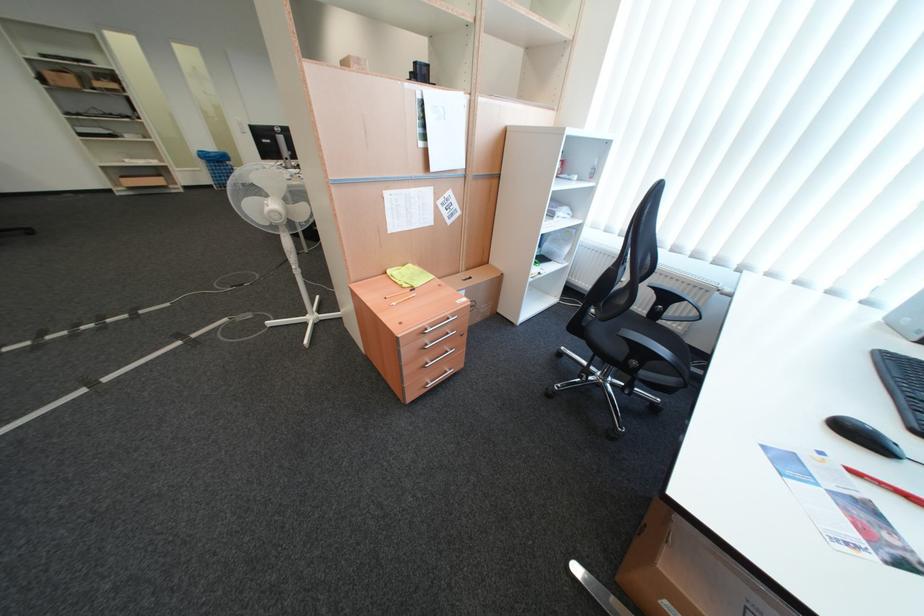
Image resolution: width=924 pixels, height=616 pixels. Find the location of `cardboard box`. cardboard box is located at coordinates (478, 290).